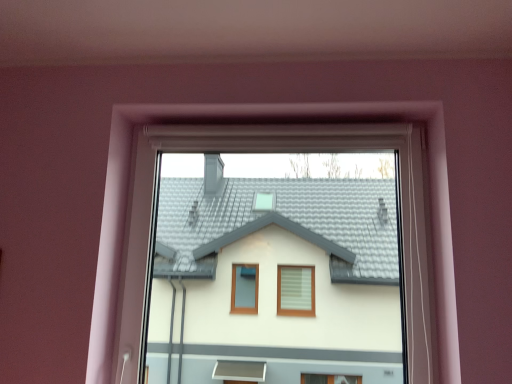
Question: Should I look upward or downward to see transparent glass window at center?

Choices:
 (A) up
 (B) down

Answer: (B)